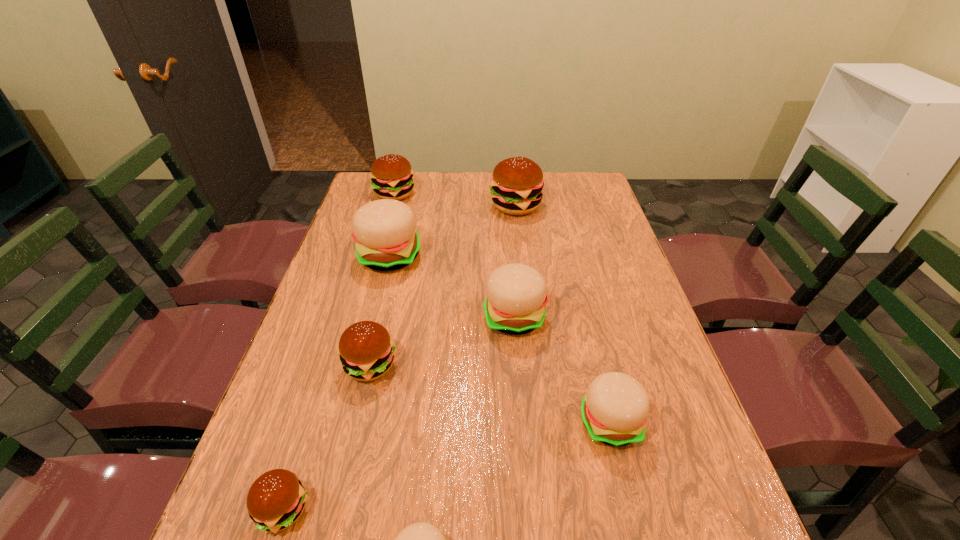
At what (x,y) coordinates should I click in order to perform the action: click on the rightmost brown hamburger. Please return your answer as a coordinate pair (x, y). This screenshot has height=540, width=960. Looking at the image, I should click on (516, 187).

Locate an element on the screen. This screenshot has width=960, height=540. the leftmost beige hamburger is located at coordinates (385, 232).

This screenshot has width=960, height=540. What are the coordinates of `the biggest beige hamburger` in the screenshot? It's located at (385, 232).

The height and width of the screenshot is (540, 960). Find the location of `the second biggest brown hamburger`. the second biggest brown hamburger is located at coordinates (391, 175).

Where is `the second beige hamburger from right to left`? The height and width of the screenshot is (540, 960). the second beige hamburger from right to left is located at coordinates (516, 294).

Find the location of a particular element. the fourth farthest hamburger is located at coordinates (516, 294).

You are a GUI agent. You are given a task and a screenshot of the screen. Output one action in this format:
    pyautogui.click(x=<x>, y=<y>)
    Task: Click on the second nearest brown hamburger
    
    Given the screenshot: What is the action you would take?
    pyautogui.click(x=366, y=351)

The height and width of the screenshot is (540, 960). I want to click on the fourth nearest object, so click(366, 351).

Identify the location of the second nearest beige hamburger. Image resolution: width=960 pixels, height=540 pixels. (614, 411).

Locate an element on the screen. The image size is (960, 540). the sixth farthest hamburger is located at coordinates [614, 411].